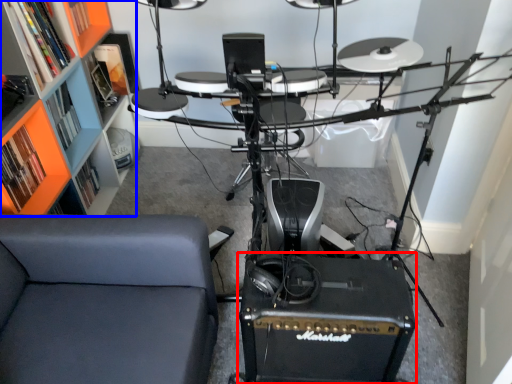
Question: Which point is further to the camera, speaker (highlighted by a red box) or shelf (highlighted by a blue box)?

Choices:
 (A) speaker
 (B) shelf

Answer: (A)